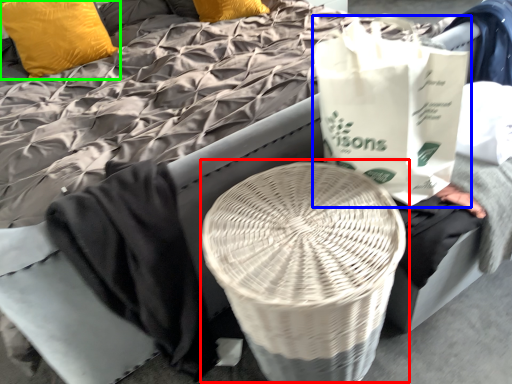
Question: Considering the real-world distances, which object is farthest from round table (highlighted by a red box)? grocery bag (highlighted by a blue box) or pillow (highlighted by a green box)?

Choices:
 (A) grocery bag
 (B) pillow

Answer: (B)